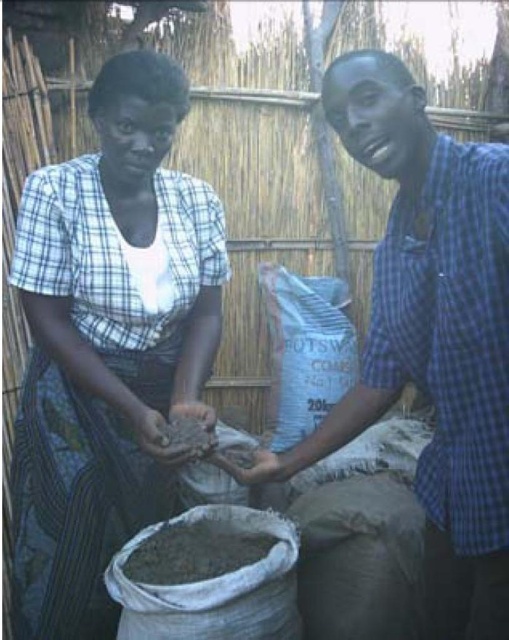
You are a photographer trying to capture the scene with the white cotton dress at center and the gray matte sand at center. Which object should you focus on first if you want to ensure both are in sharp focus?

Since the white cotton dress at center is in front of the gray matte sand at center, you should focus on the white cotton dress at center first to ensure both are in sharp focus.

Please describe the exact position of the white cotton dress at center in the image using coordinates.

The white cotton dress at center is located at coordinates point (107, 342).

You are a photographer trying to capture both the blue checkered shirt at center and the gray matte sand at center in a single frame. Based on their heights, which object should you focus on first to ensure both are in the shot?

A: The blue checkered shirt at center is much taller than the gray matte sand at center, so you should focus on the blue checkered shirt at center first to ensure both are in the shot.